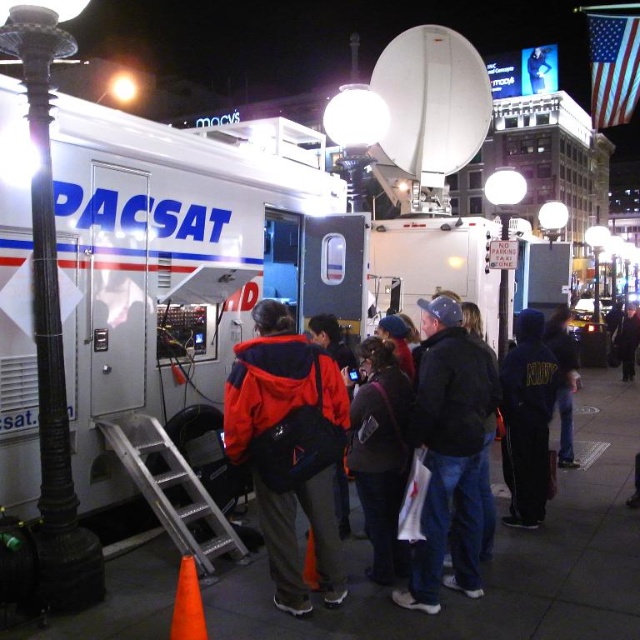
Consider the image. Who is positioned more to the left, dark blue hoodie at center or orange matte cone at lower left?

orange matte cone at lower left is more to the left.

Is dark blue hoodie at center bigger than orange matte cone at lower left?

Yes.

At what (x,y) coordinates should I click in order to perform the action: click on dark blue hoodie at center. Please return your answer as a coordinate pair (x, y). The width and height of the screenshot is (640, 640). Looking at the image, I should click on click(525, 419).

Is dark gray backpack at center above silver/aluminum ladder at lower left?

Correct, dark gray backpack at center is located above silver/aluminum ladder at lower left.

Is dark gray backpack at center to the left of silver/aluminum ladder at lower left from the viewer's perspective?

No, dark gray backpack at center is not to the left of silver/aluminum ladder at lower left.

Find the location of a particular element. dark gray backpack at center is located at coordinates (380, 454).

Identify the location of dark gray backpack at center. Image resolution: width=640 pixels, height=640 pixels. (380, 454).

Who is taller, red jacket at center or orange matte cone at lower left?

red jacket at center

Who is more distant from viewer, [506,435] or [198,600]?

The point [506,435] is behind.

Locate an element on the screen. red jacket at center is located at coordinates (451, 451).